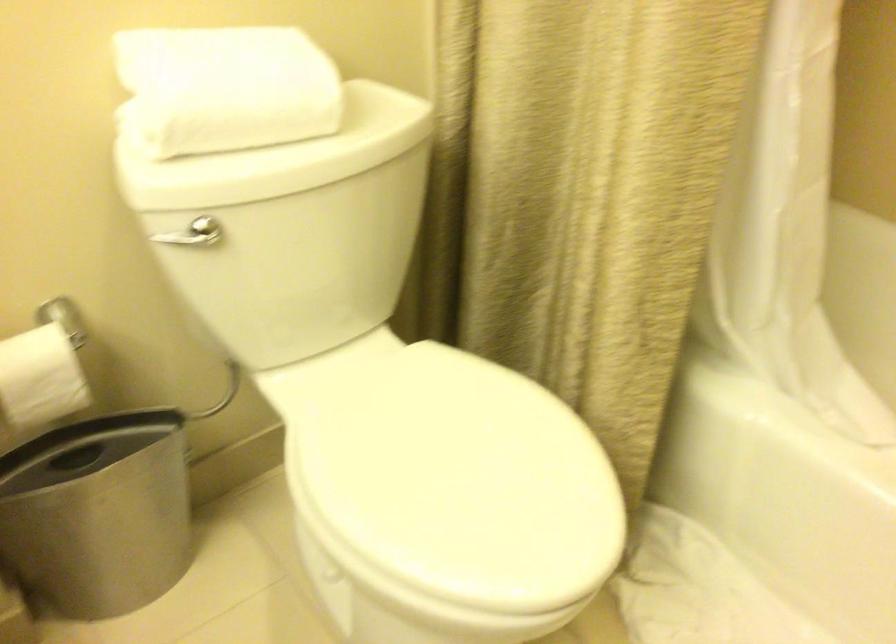
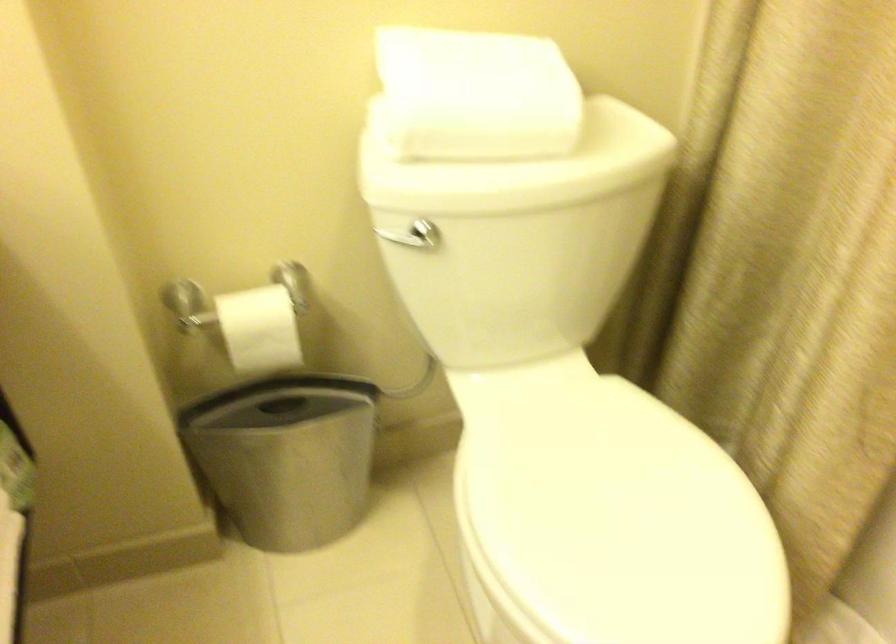
Where in the second image is the point corresponding to point 194,240 from the first image?

(410, 241)